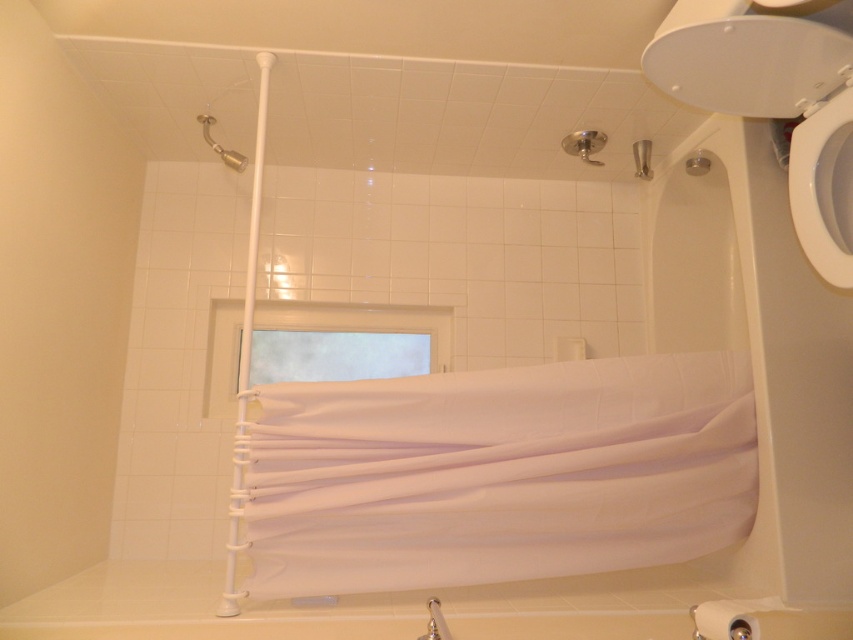
You are a bathroom cleaner who needs to reach both the white glossy toilet bowl at right and the metallic silver showerhead at upper center. Which object should you clean first if you want to start with the one that is nearest to you?

You should clean the white glossy toilet bowl at right first because it is closer to the viewer than the metallic silver showerhead at upper center.

You are standing in the bathroom and want to reach both points marked on the shower curtain. Which point, point (747, 420) or point (839, 224), is closer to you?

Point (747, 420) is further to the camera than point (839, 224), so the point closer to you is point (839, 224).

You are a contractor measuring the bathroom for renovations. You see the silver metallic towel bar at lower right and the metallic showerhead at upper left. Which object is shorter?

The silver metallic towel bar at lower right is shorter than the metallic showerhead at upper left.